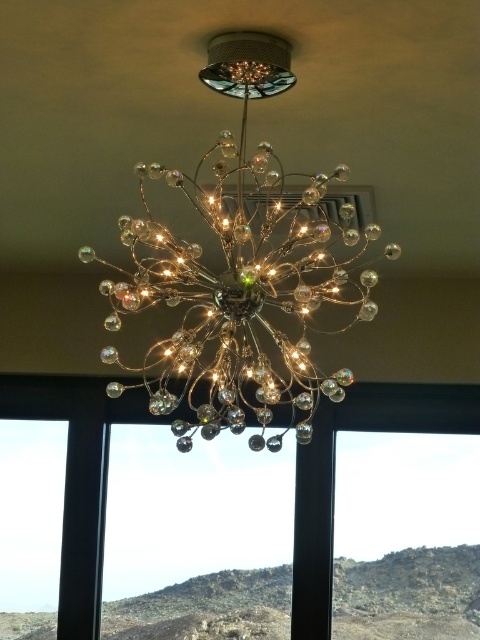
In the scene shown: Who is positioned more to the right, metallic crystal chandelier at center or transparent glass window at center?

From the viewer's perspective, transparent glass window at center appears more on the right side.

Can you confirm if metallic crystal chandelier at center is positioned below transparent glass window at center?

No.

The image size is (480, 640). Identify the location of metallic crystal chandelier at center. [240, 269].